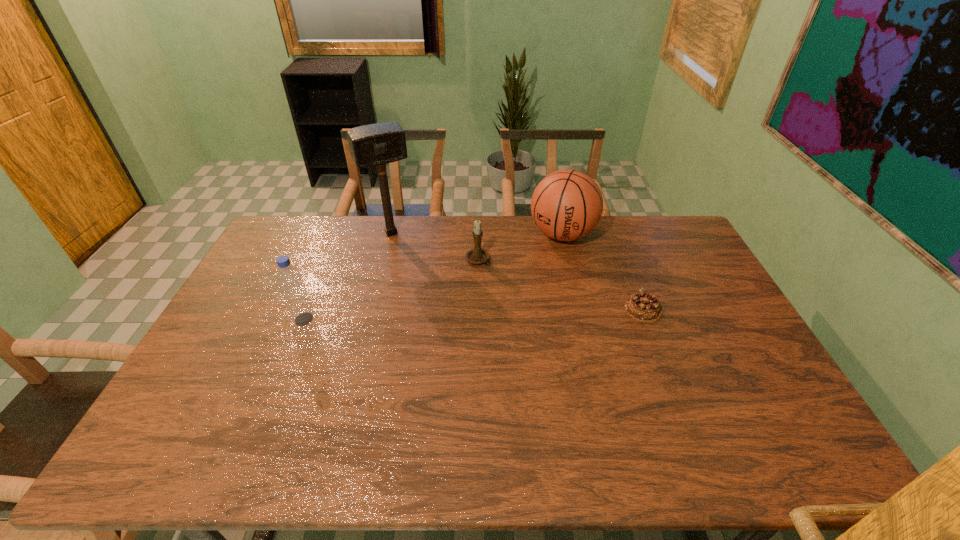
Locate an element on the screen. bottle is located at coordinates (289, 279).

Locate an element on the screen. Image resolution: width=960 pixels, height=540 pixels. chocolate cake is located at coordinates (642, 307).

This screenshot has width=960, height=540. What are the coordinates of `the shortest object` in the screenshot? It's located at (642, 307).

Where is `the tallest object`? This screenshot has height=540, width=960. the tallest object is located at coordinates (377, 144).

Find the location of a particular element. Image resolution: width=960 pixels, height=540 pixels. the fourth object from right to left is located at coordinates point(377,144).

This screenshot has height=540, width=960. I want to click on the third object from left to right, so click(477, 255).

You are a GUI agent. You are given a task and a screenshot of the screen. Output one action in this format:
    pyautogui.click(x=<x>, y=<y>)
    Task: Click on the fourth tallest object
    The image size is (960, 540).
    Given the screenshot: What is the action you would take?
    pyautogui.click(x=477, y=255)

Image resolution: width=960 pixels, height=540 pixels. In order to click on the fourth object from left to right in this screenshot , I will do `click(566, 205)`.

The width and height of the screenshot is (960, 540). I want to click on vacant space located on the left of the leftmost object, so click(x=237, y=319).

You are a GUI agent. You are given a task and a screenshot of the screen. Output one action in this format:
    pyautogui.click(x=<x>, y=<y>)
    Task: Click on the free space located 0.050m on the right of the rightmost object
    The height and width of the screenshot is (540, 960).
    Given the screenshot: What is the action you would take?
    pyautogui.click(x=679, y=309)